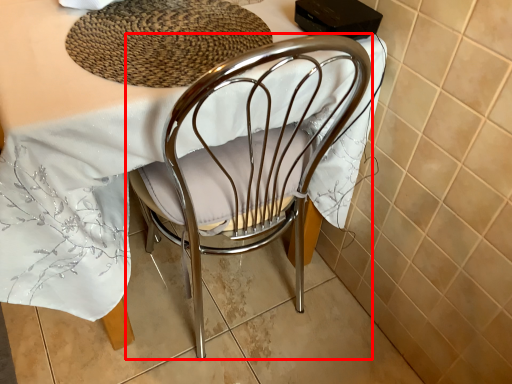
Question: Considering the relative positions of chair (annotated by the red box) and mat in the image provided, where is chair (annotated by the red box) located with respect to the staircase?

Choices:
 (A) left
 (B) right

Answer: (A)